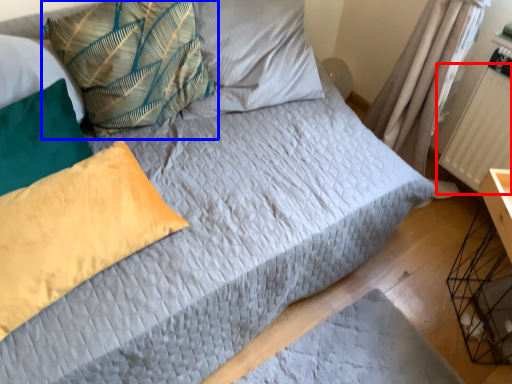
Question: Among these objects, which one is farthest to the camera, radiator (highlighted by a red box) or pillow (highlighted by a blue box)?

Choices:
 (A) radiator
 (B) pillow

Answer: (A)